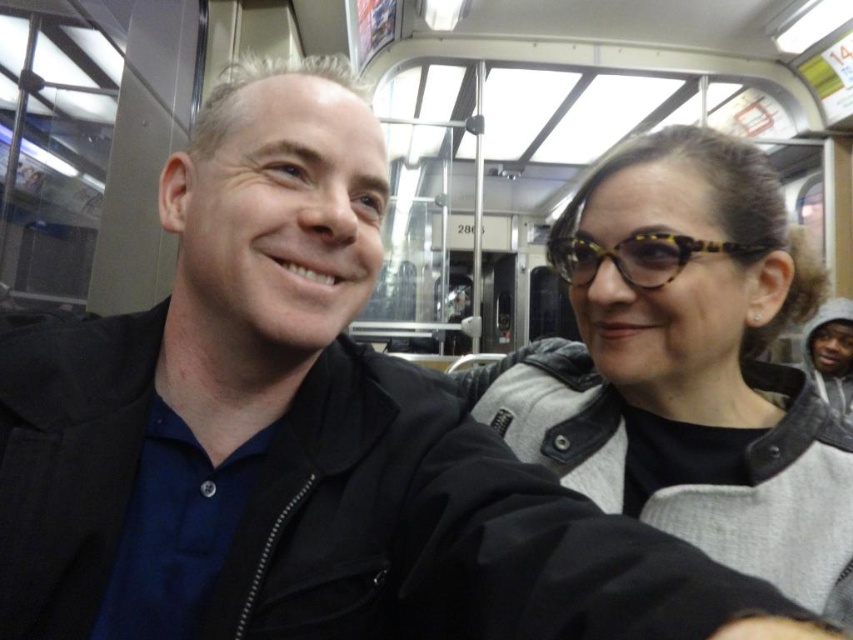
You are a photographer taking a picture of the matte black jacket at center and the tortoiseshell acetate goggles at upper right. Which object should you focus on first if you want to capture both in sharp focus?

The matte black jacket at center is located below tortoiseshell acetate goggles at upper right. To capture both in sharp focus, you should focus on the matte black jacket at center first since it is closer to the camera than the tortoiseshell acetate goggles at upper right.

You are a photographer positioned outside the subway car. You want to capture a photo where both the matte black jacket at center and the tortoiseshell acetate goggles at upper right are clearly visible. Considering their sizes, which object should you focus on first to ensure both are in focus?

The matte black jacket at center is taller than the tortoiseshell acetate goggles at upper right. To ensure both are in focus, you should focus on the matte black jacket at center first since it is larger and requires more precise focusing.